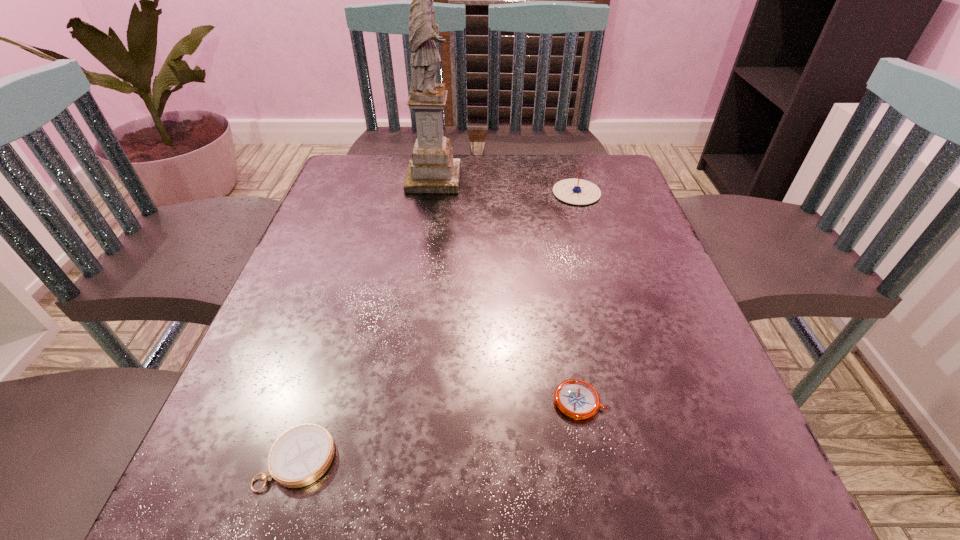
You are a GUI agent. You are given a task and a screenshot of the screen. Output one action in this format:
    pyautogui.click(x=<x>, y=<y>)
    Task: Click on the free spot between the third tallest object and the second tallest object
    The image size is (960, 540).
    Given the screenshot: What is the action you would take?
    pyautogui.click(x=437, y=326)

Find the location of a particular element. This screenshot has height=540, width=960. free space between the third tallest object and the second tallest object is located at coordinates (437, 326).

At what (x,y) coordinates should I click in order to perform the action: click on vacant space that's between the third shortest object and the nearest compass. Please return your answer as a coordinate pair (x, y). This screenshot has width=960, height=540. Looking at the image, I should click on (437, 326).

Identify the location of free spot between the second farthest compass and the second shortest object. The width and height of the screenshot is (960, 540). (439, 430).

Where is `object that is the second nearest to the shortest object`? object that is the second nearest to the shortest object is located at coordinates (573, 191).

Find the location of `the closest object relative to the second tallest object`. the closest object relative to the second tallest object is located at coordinates (432, 169).

Locate an element on the screen. The height and width of the screenshot is (540, 960). compass that is the closest one to the leftmost object is located at coordinates (576, 399).

Where is `compass that is the second nearest to the third shortest object`? compass that is the second nearest to the third shortest object is located at coordinates (301, 455).

Where is `vacant point that satisfies the following two spatial constraints: 1. on the back side of the shortest compass; 2. on the right side of the second tallest compass`? vacant point that satisfies the following two spatial constraints: 1. on the back side of the shortest compass; 2. on the right side of the second tallest compass is located at coordinates (315, 401).

Where is `vacant space that satisfies the following two spatial constraints: 1. on the front-facing side of the second farthest compass; 2. on the left side of the tallest object`? vacant space that satisfies the following two spatial constraints: 1. on the front-facing side of the second farthest compass; 2. on the left side of the tallest object is located at coordinates (400, 401).